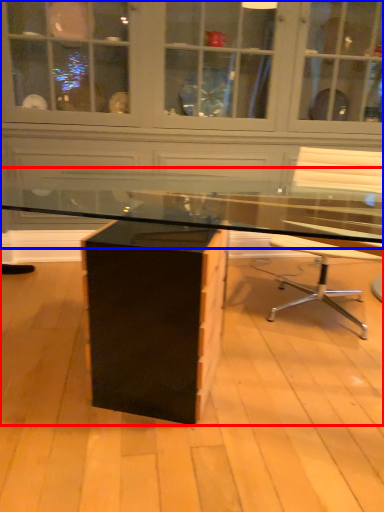
Question: Which object appears farthest to the camera in this image, desk (highlighted by a red box) or dresser (highlighted by a blue box)?

Choices:
 (A) desk
 (B) dresser

Answer: (B)